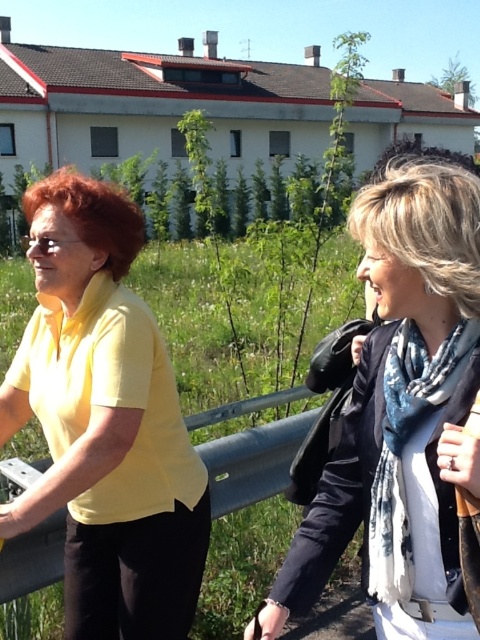
Is white scarf at center positioned at the back of blue printed scarf at right?

That is False.

Between white scarf at center and blue printed scarf at right, which one is positioned lower?

blue printed scarf at right is lower down.

Based on the photo, who is more distant from viewer, (363, 189) or (391, 532)?

Point (363, 189)

At what (x,y) coordinates should I click in order to perform the action: click on white scarf at center. Please return your answer as a coordinate pair (x, y). This screenshot has height=640, width=480. Looking at the image, I should click on (402, 417).

What do you see at coordinates (105, 422) in the screenshot? This screenshot has height=640, width=480. I see `yellow matte shirt at left` at bounding box center [105, 422].

The width and height of the screenshot is (480, 640). What do you see at coordinates (105, 422) in the screenshot? I see `yellow matte shirt at left` at bounding box center [105, 422].

Locate an element on the screen. The image size is (480, 640). yellow matte shirt at left is located at coordinates (105, 422).

Who is more forward, (169, 472) or (407, 202)?

Point (407, 202) is more forward.

Does yellow matte shirt at left lie in front of white scarf at center?

That is False.

At what (x,y) coordinates should I click in order to perform the action: click on yellow matte shirt at left. Please return your answer as a coordinate pair (x, y). Looking at the image, I should click on (105, 422).